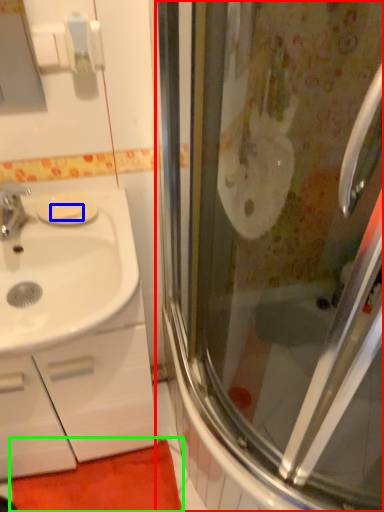
Question: Based on their relative distances, which object is farther from screen door (highlighted by a red box)? Choose from soap (highlighted by a blue box) and bath mat (highlighted by a green box).

Choices:
 (A) soap
 (B) bath mat

Answer: (A)